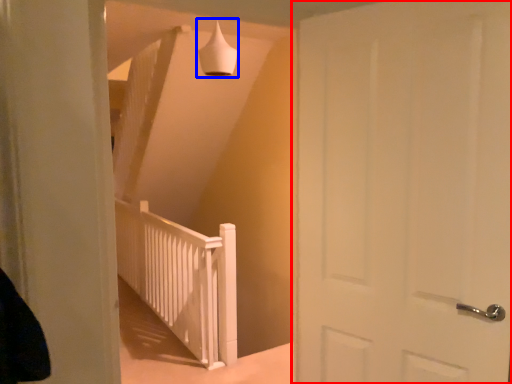
Question: Which point is further to the camera, door (highlighted by a red box) or lamp (highlighted by a blue box)?

Choices:
 (A) door
 (B) lamp

Answer: (B)